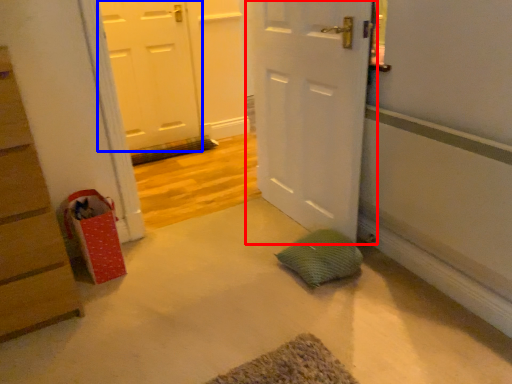
Question: Among these objects, which one is nearest to the camera, door (highlighted by a red box) or door (highlighted by a blue box)?

Choices:
 (A) door
 (B) door

Answer: (A)